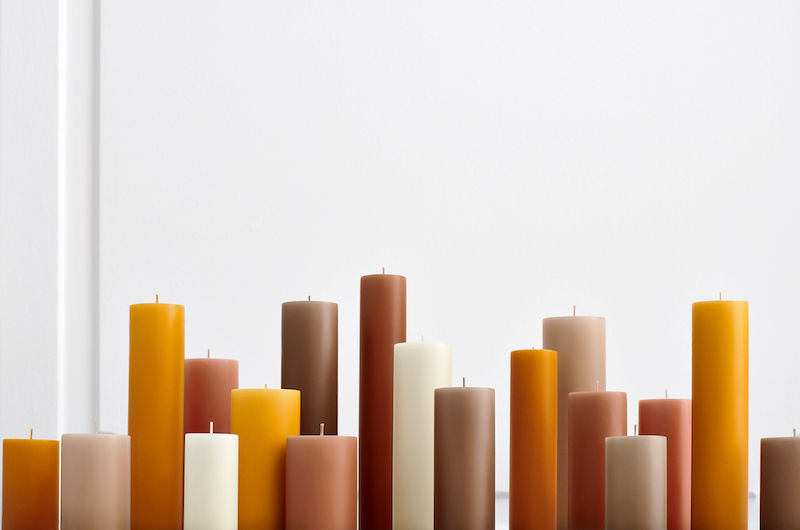
I want to click on orange candle, so click(x=22, y=469), click(x=160, y=359), click(x=282, y=418), click(x=532, y=383), click(x=706, y=357).